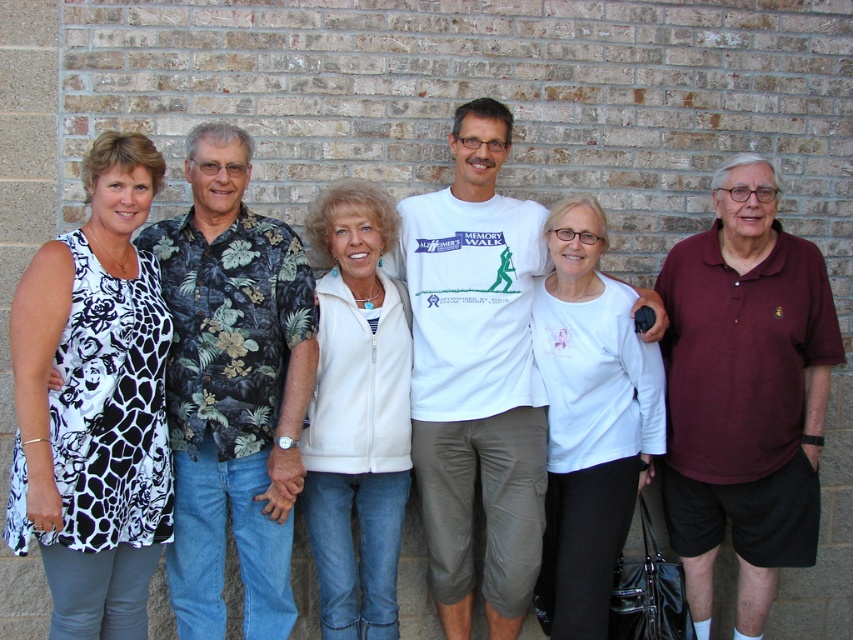
Can you confirm if white cotton shirt at center is positioned to the left of white fleece vest at center?

Incorrect, white cotton shirt at center is not on the left side of white fleece vest at center.

Which is in front, point (421, 205) or point (386, 413)?

Point (386, 413) is more forward.

Locate an element on the screen. white cotton shirt at center is located at coordinates [x=476, y=374].

Between white cotton shirt at center and white matte shirt at center, which one appears on the right side from the viewer's perspective?

white matte shirt at center

Between white cotton shirt at center and white matte shirt at center, which one has less height?

Standing shorter between the two is white matte shirt at center.

Between point (485, 244) and point (561, 442), which one is positioned behind?

Point (485, 244)

Image resolution: width=853 pixels, height=640 pixels. I want to click on white cotton shirt at center, so click(476, 374).

Can you confirm if maroon polo shirt at right is wider than white matte shirt at center?

Yes.

Image resolution: width=853 pixels, height=640 pixels. Describe the element at coordinates (744, 392) in the screenshot. I see `maroon polo shirt at right` at that location.

Where is `maroon polo shirt at right`? This screenshot has width=853, height=640. maroon polo shirt at right is located at coordinates (744, 392).